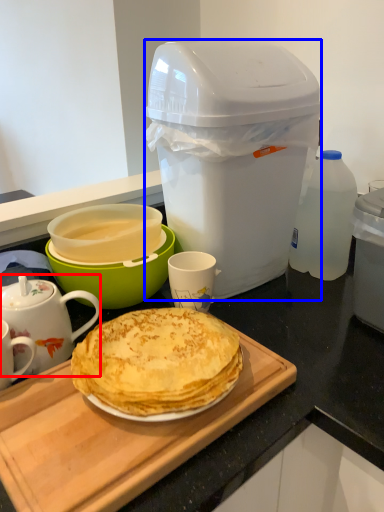
Question: Among these objects, which one is nearest to the camera, teapot (highlighted by a red box) or trash bin/can (highlighted by a blue box)?

Choices:
 (A) teapot
 (B) trash bin/can

Answer: (A)